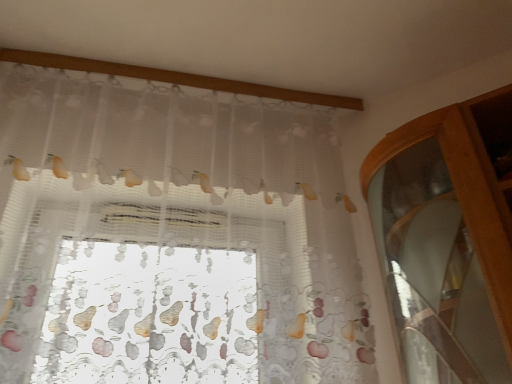
Question: Which direction should I rotate to look at translucent floral-patterned curtain at center?

Choices:
 (A) left
 (B) right

Answer: (A)